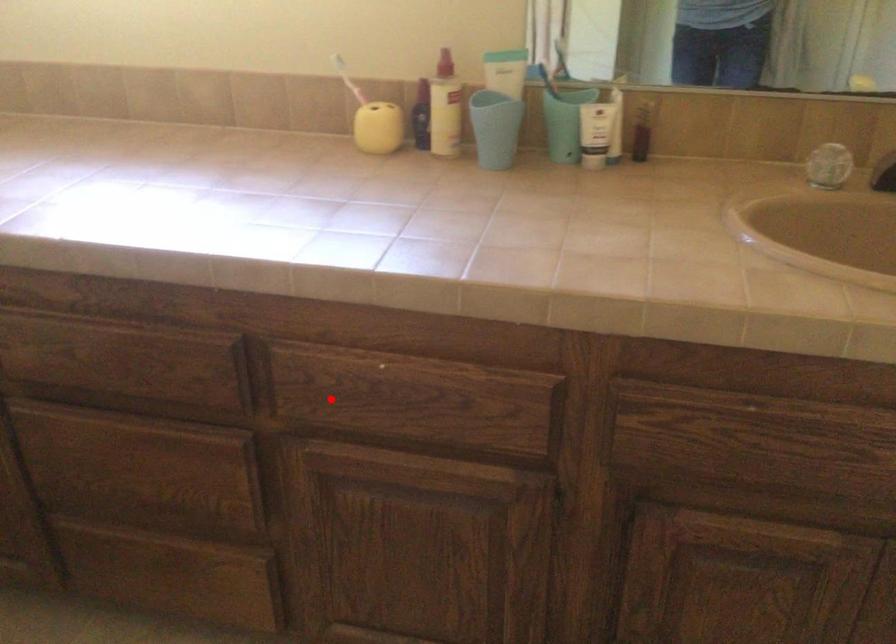
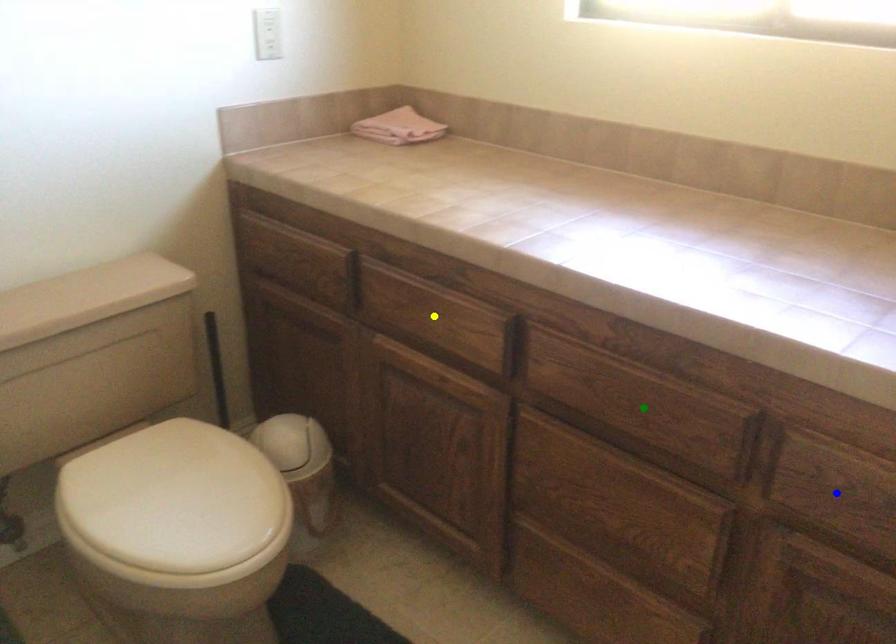
Question: I am providing you with two images of the same scene from different viewpoints. A red point is marked on the first image. You are given multiple points on the second image. In image 2, which mark is for the same physical point as the one in image 1?

Choices:
 (A) yellow point
 (B) blue point
 (C) green point

Answer: (B)